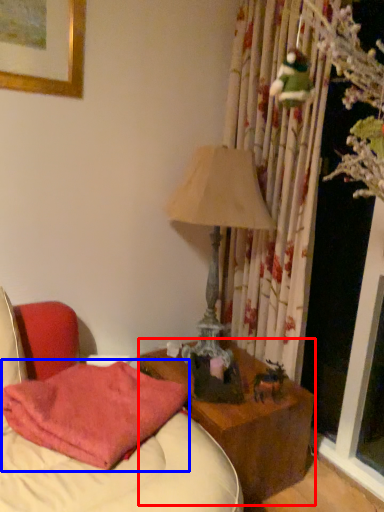
Question: Which point is further to the camera, nightstand (highlighted by a red box) or pillow (highlighted by a blue box)?

Choices:
 (A) nightstand
 (B) pillow

Answer: (A)